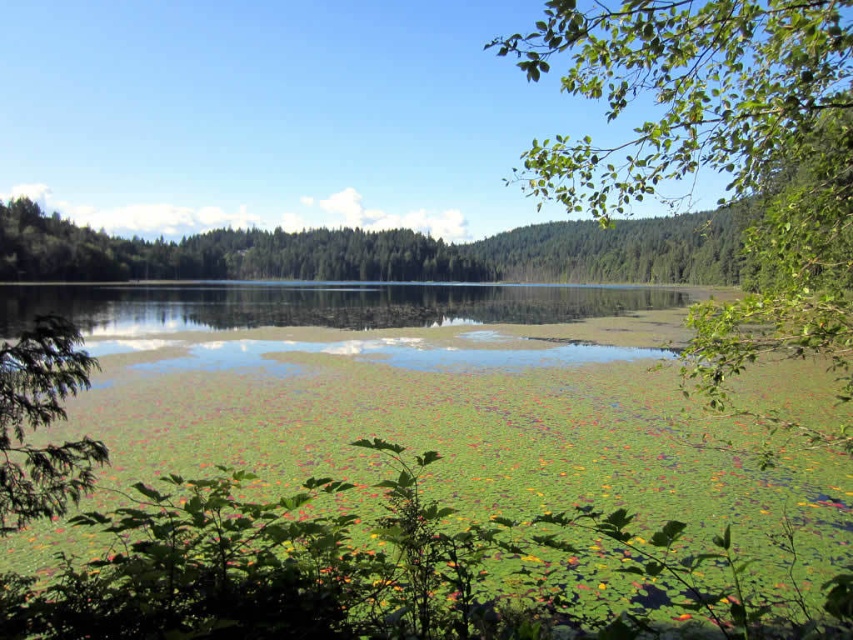
You are standing in the middle of the scene and looking towards the green leafy branch at upper right and the green leafy tree at left. Which object is higher in the frame?

The green leafy branch at upper right is located above the green leafy tree at left in the frame.

You are observing the scene and want to know the relative positions of the green leafy branch at upper right and the green leafy tree at left. Which one is located to the right of the other?

The green leafy branch at upper right is positioned on the right side of green leafy tree at left.